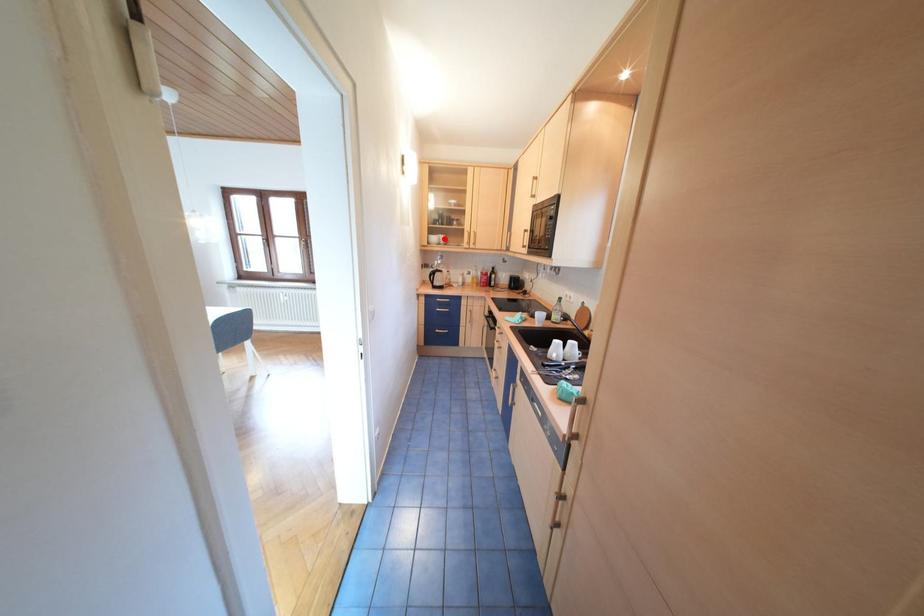
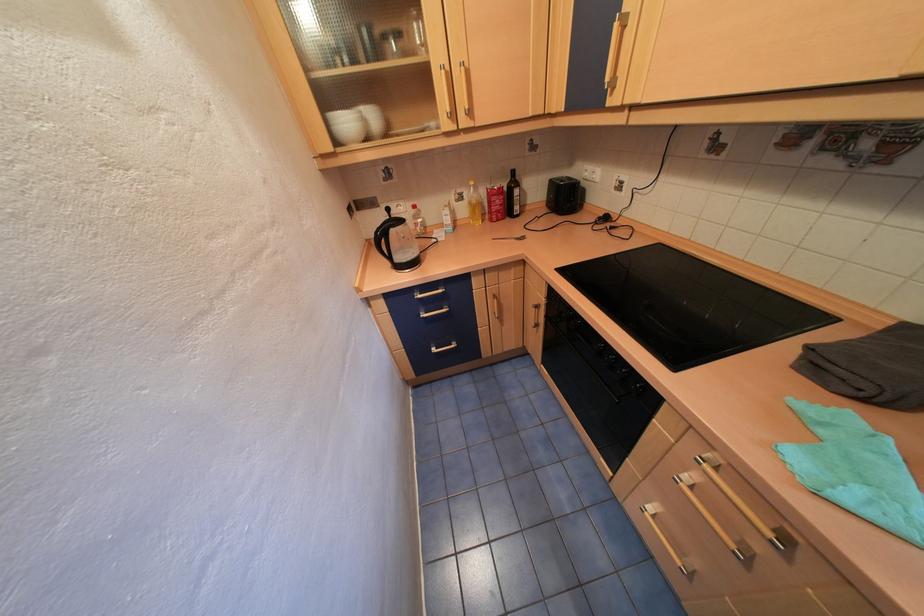
Question: I am providing you with two images of the same scene from different viewpoints. A red point is marked on the first image. At the location where the point appears in image 1, is it still visible in image 2?

Choices:
 (A) Yes
 (B) No

Answer: (A)